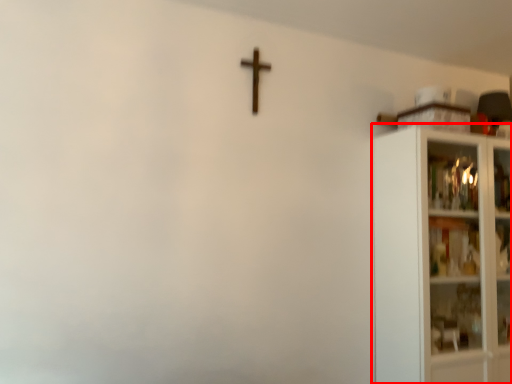
Question: In this image, where is shelf (annotated by the red box) located relative to crucifix?

Choices:
 (A) left
 (B) right

Answer: (B)